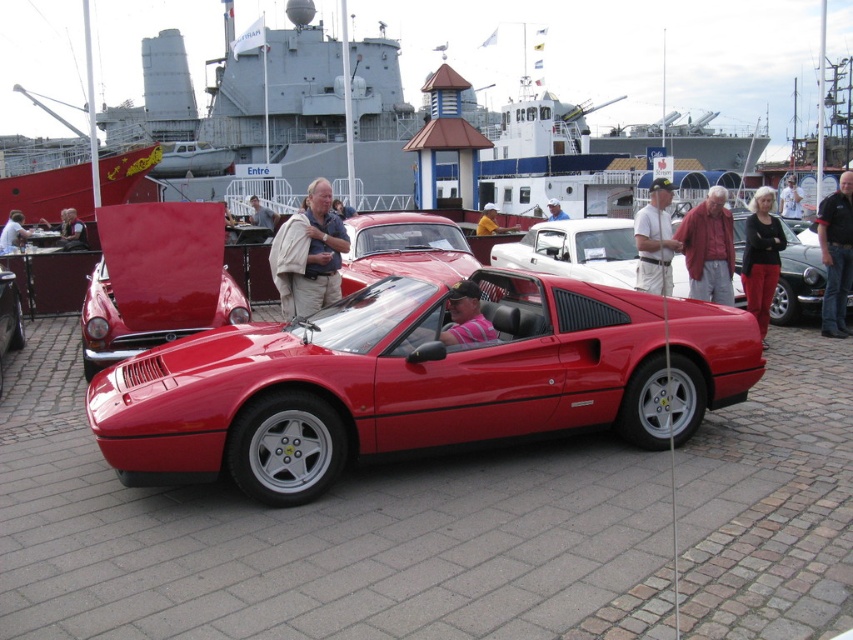
Where is `white fabric shirt at center`? white fabric shirt at center is located at coordinates (654, 241).

Who is more forward, (670, 276) or (4, 237)?

Positioned in front is point (670, 276).

This screenshot has width=853, height=640. I want to click on white fabric shirt at center, so click(x=654, y=241).

Is point (656, 212) positioned in front of point (798, 188)?

Yes, point (656, 212) is closer to viewer.

Which is in front, point (670, 202) or point (790, 173)?

Point (670, 202)

What do you see at coordinates (654, 241) in the screenshot? This screenshot has height=640, width=853. I see `white fabric shirt at center` at bounding box center [654, 241].

This screenshot has width=853, height=640. I want to click on white fabric shirt at center, so tap(654, 241).

Measure the distance between black leather jacket at center and matte black jacket at upper right.

black leather jacket at center is 3.73 feet away from matte black jacket at upper right.

Does black leather jacket at center appear over matte black jacket at upper right?

Yes.

Who is more forward, (824,196) or (750,292)?

Positioned in front is point (750,292).

Locate an element on the screen. The image size is (853, 640). black leather jacket at center is located at coordinates (836, 253).